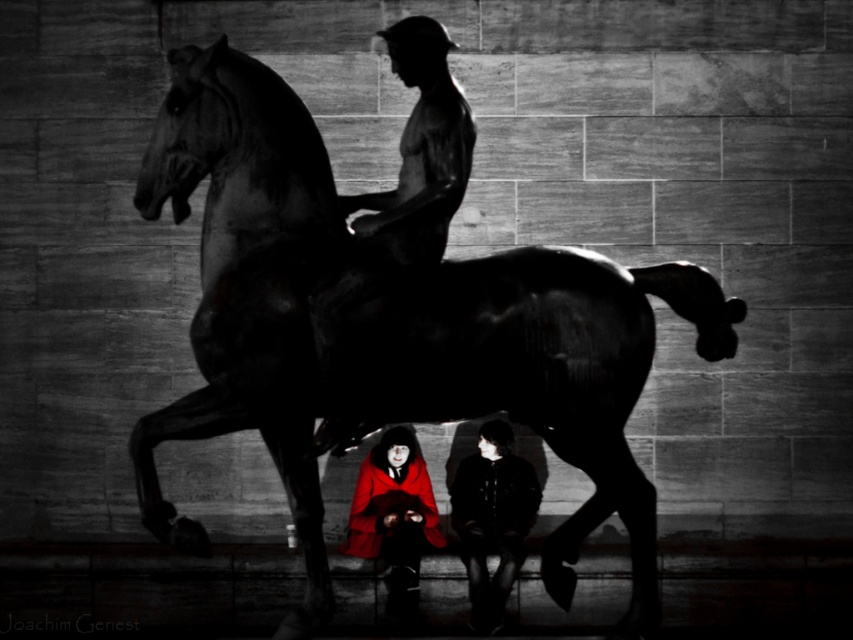
You are an artist trying to sketch the scene. You notice two elements at the center of the image. Which one is taller between the smooth dark skin at center and the red velvet cloak at center?

The smooth dark skin at center is taller than the red velvet cloak at center.

You are standing in front of the statue and need to determine the distance between two points marked in the image. The first point is at coordinates point (561, 275) and the second point is at point (485, 548). Which point is closer to you?

Point (561, 275) is closer to the viewer than point (485, 548).